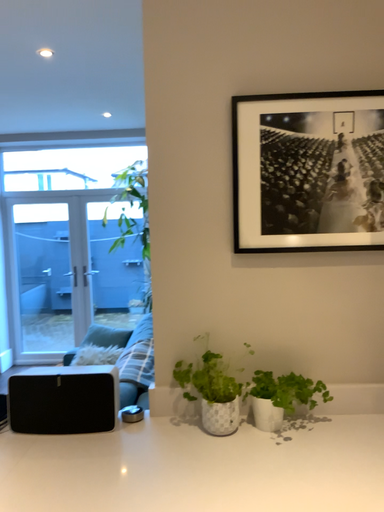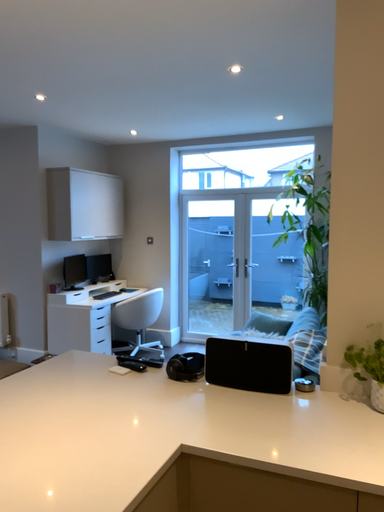
Question: How did the camera likely rotate when shooting the video?

Choices:
 (A) rotated left
 (B) rotated right

Answer: (A)